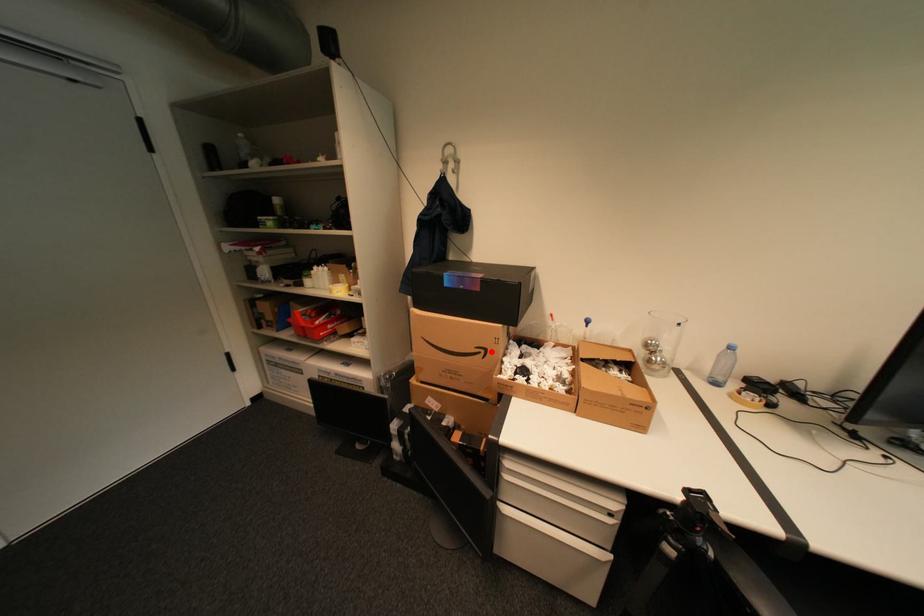
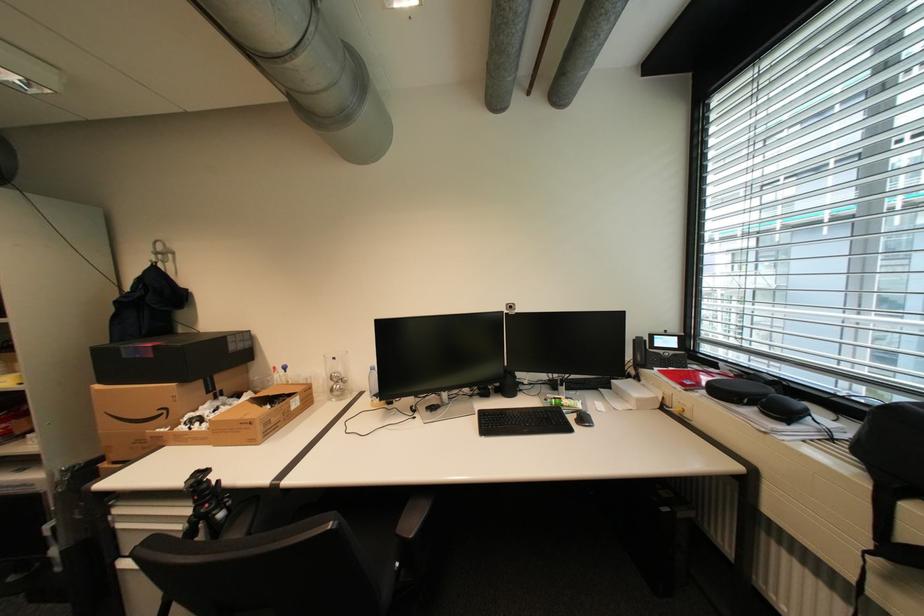
The point at the highlighted location is marked in the first image. Where is the corresponding point in the second image?

(174, 411)